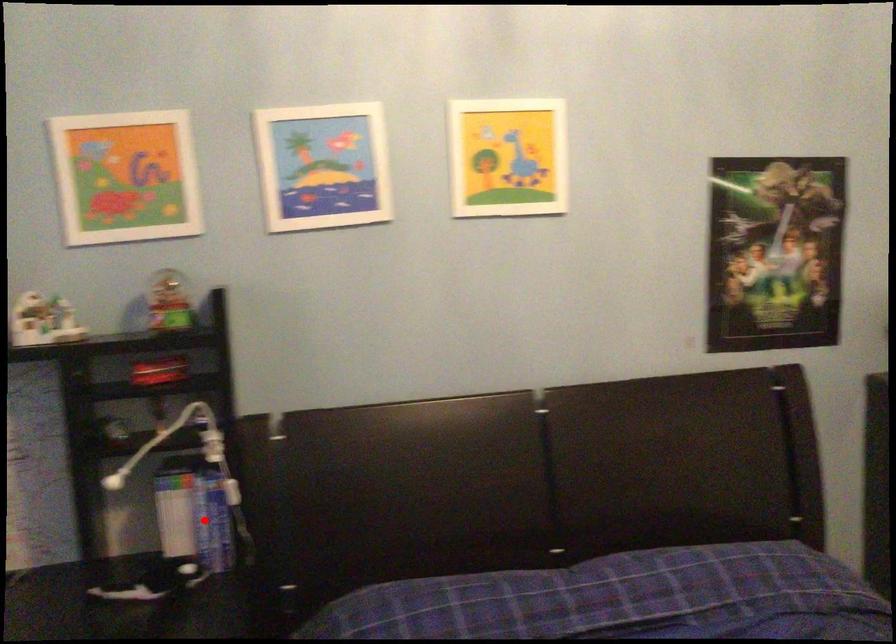
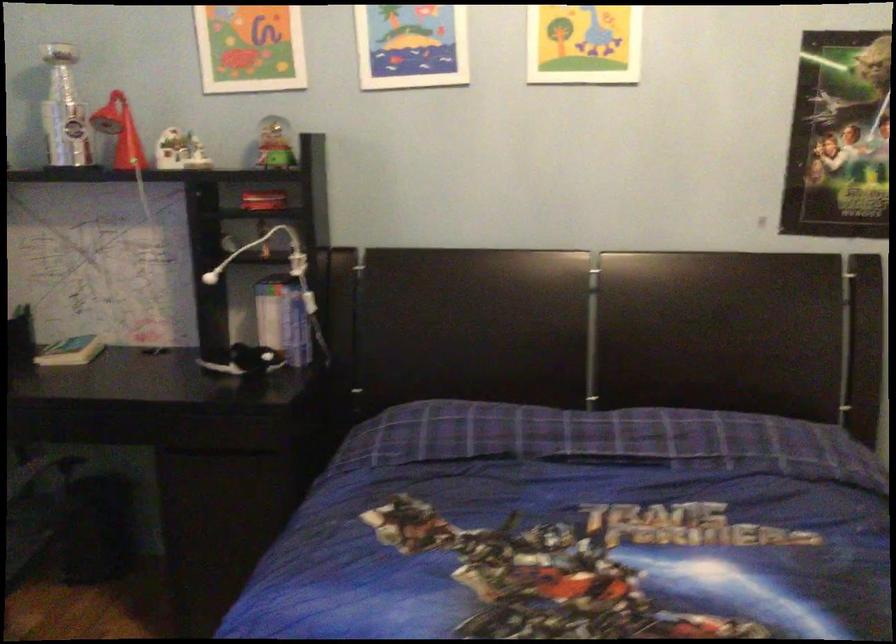
Locate, in the second image, the point that corresponds to the highlighted location in the first image.

(288, 321)